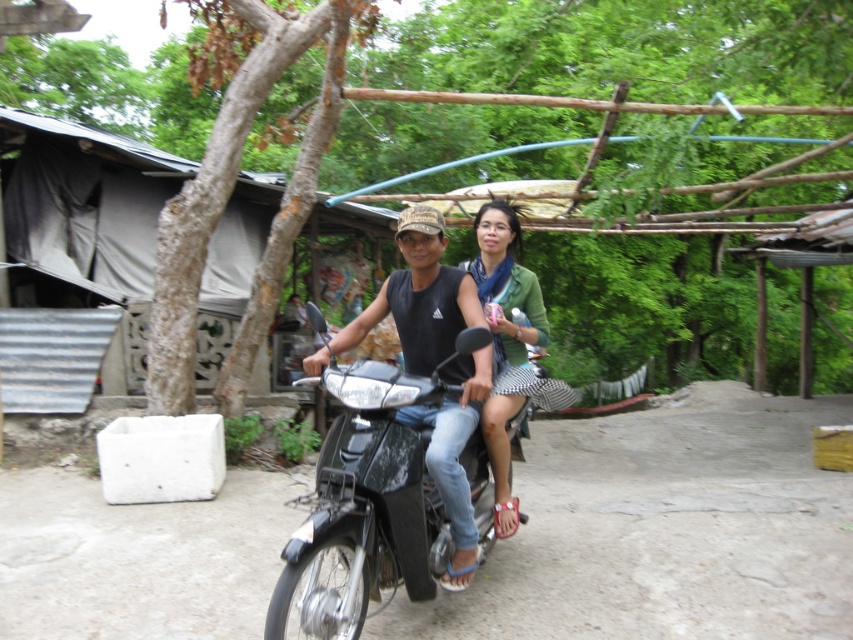
Where is `shiny black motorcycle at center`? shiny black motorcycle at center is located at coordinates (367, 500).

Does shiny black motorcycle at center appear on the left side of green matte shirt at center?

Indeed, shiny black motorcycle at center is positioned on the left side of green matte shirt at center.

Where is `shiny black motorcycle at center`? The height and width of the screenshot is (640, 853). shiny black motorcycle at center is located at coordinates (367, 500).

Which is more to the left, matte black motorcycle at center or green matte shirt at center?

Positioned to the left is matte black motorcycle at center.

From the picture: Does matte black motorcycle at center lie behind green matte shirt at center?

No.

The width and height of the screenshot is (853, 640). I want to click on matte black motorcycle at center, so 415,300.

Find the location of a particular element. The image size is (853, 640). matte black motorcycle at center is located at coordinates pyautogui.click(x=415, y=300).

The width and height of the screenshot is (853, 640). Describe the element at coordinates (367, 500) in the screenshot. I see `shiny black motorcycle at center` at that location.

Is point (467, 352) in front of point (405, 420)?

Yes, it is in front of point (405, 420).

Identify the location of shiny black motorcycle at center. This screenshot has height=640, width=853. (367, 500).

Identify the location of shiny black motorcycle at center. (367, 500).